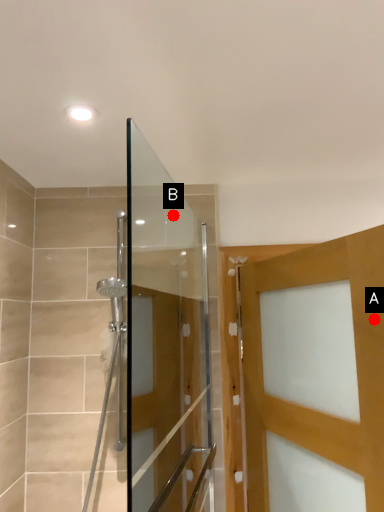
Question: Two points are circled on the image, labeled by A and B beside each circle. Which point is farther from the camera taking this photo?

Choices:
 (A) A is further
 (B) B is further

Answer: (B)